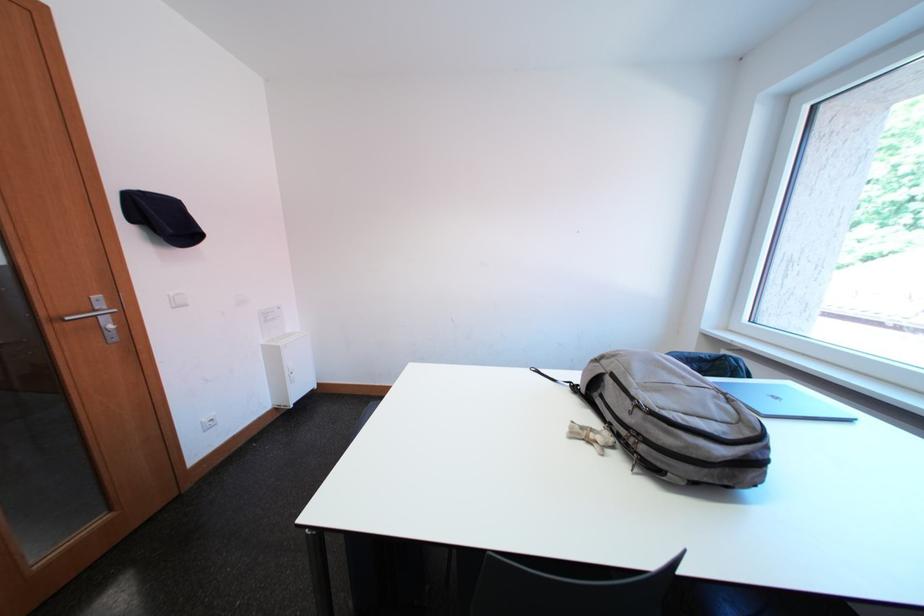
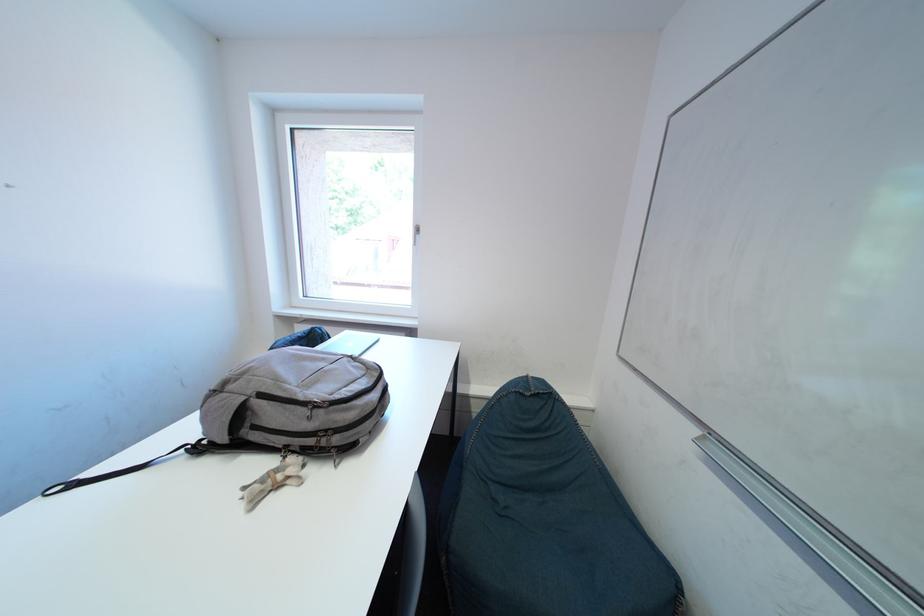
Question: The camera is either moving clockwise (left) or counter-clockwise (right) around the object. The first image is from the beginning of the video and the second image is from the end. Is the camera moving left or right when shooting the video?

Choices:
 (A) Left
 (B) Right

Answer: (A)